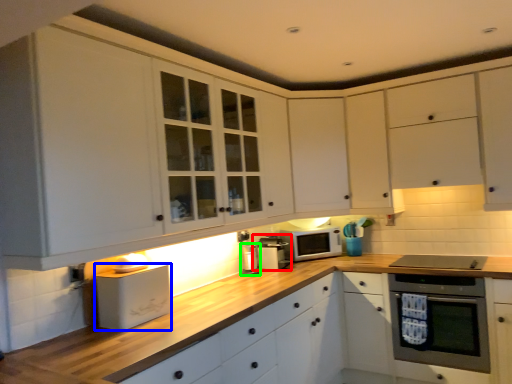
Question: Which is nearer to the appliance (highlighted by a red box)? appliance (highlighted by a blue box) or appliance (highlighted by a green box).

Choices:
 (A) appliance
 (B) appliance

Answer: (B)